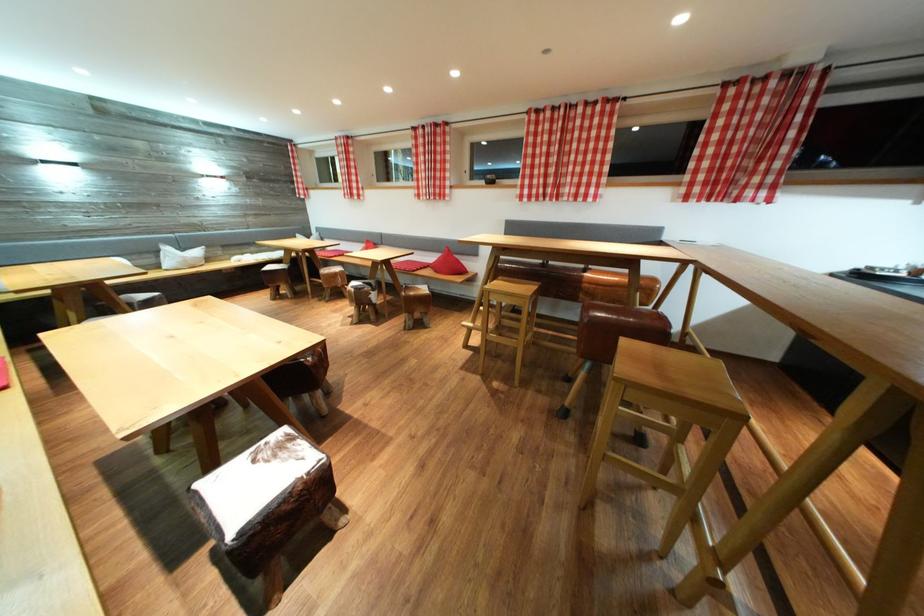
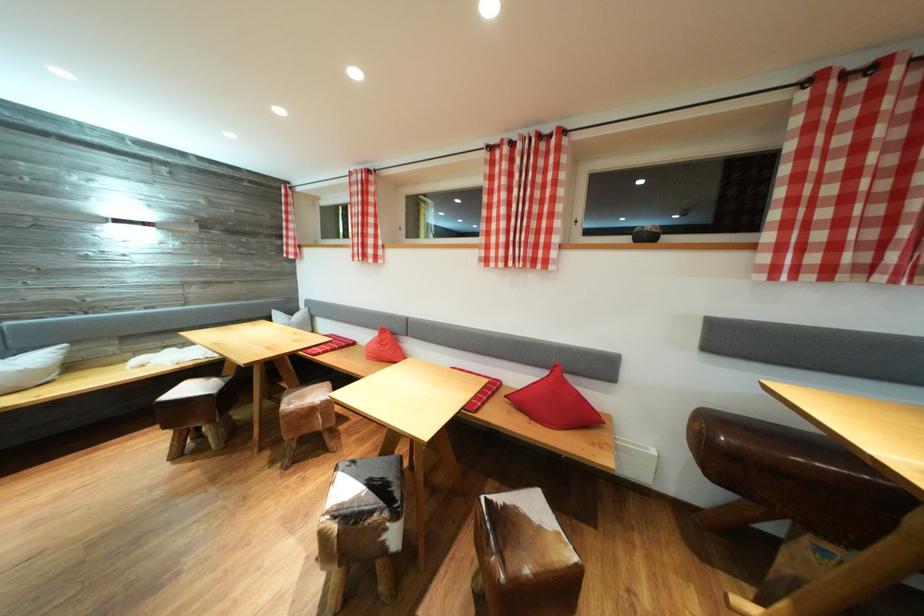
Where in the second image is the point corresponding to (x=426, y=201) from the first image?

(492, 265)